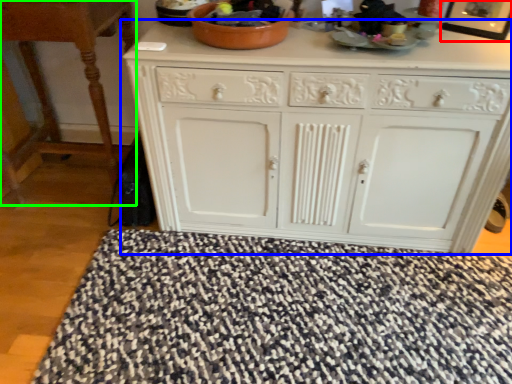
Question: Estimate the real-world distances between objects in this image. Which object is closer to picture frame (highlighted by a red box), chest of drawers (highlighted by a blue box) or table (highlighted by a green box)?

Choices:
 (A) chest of drawers
 (B) table

Answer: (A)